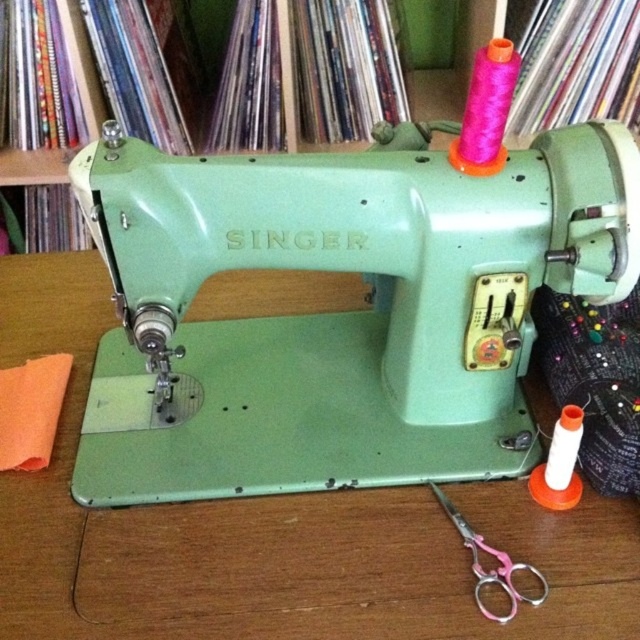
You are standing in front of the sewing machine and want to place a new spool of thread on the sewing machine. Based on the coordinates of the green matte sewing machine at center, where should you place the new spool?

The green matte sewing machine at center is located at coordinates point (272, 532), so you should place the new spool of thread on the sewing machine at that position.

You are organizing a craft workshop and need to place a decorative mat under the pink plastic scissors at lower right. The mat must not cover the matte green sewing machine at center. Based on their positions, where should you place the mat?

The matte green sewing machine at center is located above the pink plastic scissors at lower right, so you should place the mat below the pink plastic scissors at lower right to avoid covering the sewing machine.

You are standing in front of a sewing machine and need to place a new spool of thread. The sewing machine is located at point (x=342, y=312). Where should you place the new spool relative to the sewing machine?

The point (x=342, y=312) indicates the matte green sewing machine at center, so the new spool should be placed on top of or to the right of the sewing machine as those are the existing spool locations.